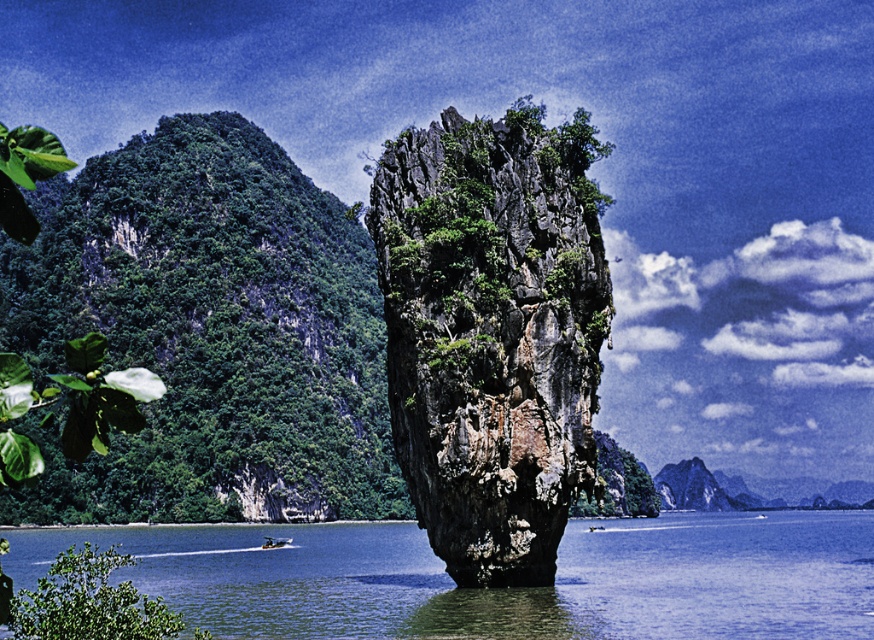
Which is more to the right, green leafy vegetation at left or green leafy bush at lower left?

Positioned to the right is green leafy bush at lower left.

Between green leafy vegetation at left and green leafy bush at lower left, which one has more height?

Standing taller between the two is green leafy vegetation at left.

Between point (18, 314) and point (78, 596), which one is positioned behind?

Point (18, 314)

You are a GUI agent. You are given a task and a screenshot of the screen. Output one action in this format:
    pyautogui.click(x=<x>, y=<y>)
    Task: Click on the green leafy vegetation at left
    This screenshot has height=640, width=874.
    Given the screenshot: What is the action you would take?
    pyautogui.click(x=207, y=332)

Is green leafy vegetation at left positioned behind clear blue water at center?

Yes, it is.

Between green leafy vegetation at left and clear blue water at center, which one is positioned lower?

Positioned lower is clear blue water at center.

Which is in front, point (247, 147) or point (232, 630)?

Point (232, 630) is more forward.

You are a GUI agent. You are given a task and a screenshot of the screen. Output one action in this format:
    pyautogui.click(x=<x>, y=<y>)
    Task: Click on the green leafy vegetation at left
    The height and width of the screenshot is (640, 874).
    Given the screenshot: What is the action you would take?
    pyautogui.click(x=207, y=332)

Between green mossy rock at center and clear blue water at center, which one appears on the left side from the viewer's perspective?

green mossy rock at center

The image size is (874, 640). What do you see at coordinates (491, 332) in the screenshot?
I see `green mossy rock at center` at bounding box center [491, 332].

Does point (420, 472) come in front of point (630, 568)?

Yes, it is.

The image size is (874, 640). I want to click on green mossy rock at center, so click(491, 332).